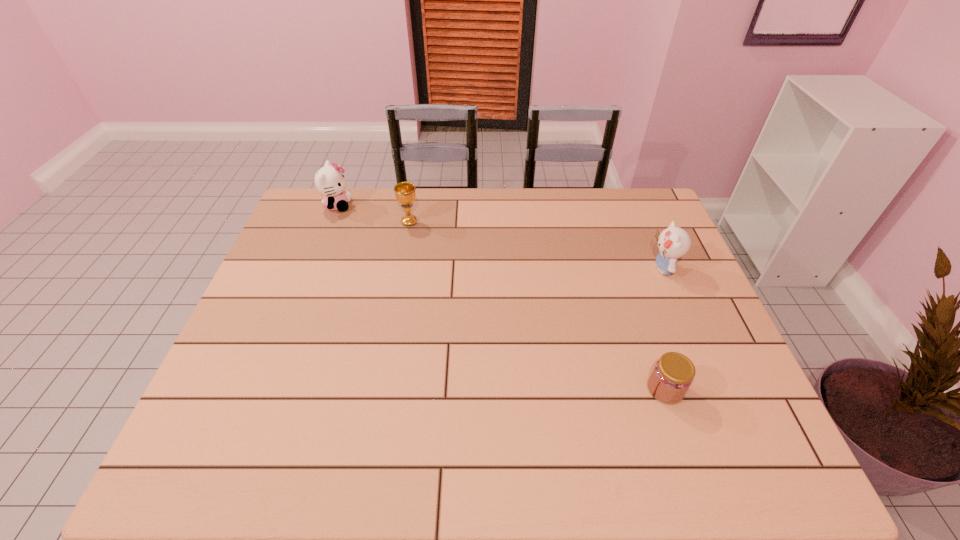
Image resolution: width=960 pixels, height=540 pixels. Find the location of `free location that satisfies the following two spatial constraints: 1. on the front-facing side of the shortest object; 2. on the right side of the left kitten`. free location that satisfies the following two spatial constraints: 1. on the front-facing side of the shortest object; 2. on the right side of the left kitten is located at coordinates [267, 389].

The width and height of the screenshot is (960, 540). Find the location of `vacant space that satisfies the following two spatial constraints: 1. on the front-facing side of the farther kitten; 2. on the left side of the chalice`. vacant space that satisfies the following two spatial constraints: 1. on the front-facing side of the farther kitten; 2. on the left side of the chalice is located at coordinates (331, 222).